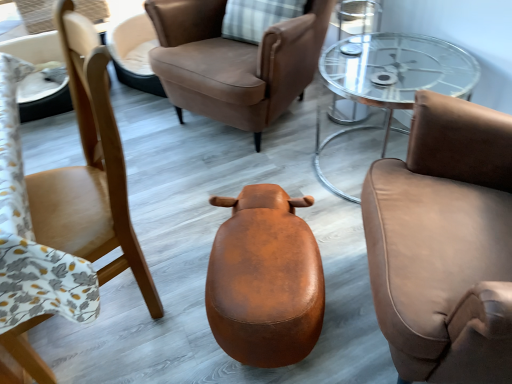
Question: Is brown leather chair at right, which is the 1th chair from right to left, at the right side of brown leather stool at center?

Choices:
 (A) yes
 (B) no

Answer: (A)

Question: From a real-world perspective, is brown leather chair at right, which is the 1th chair from right to left, positioned under brown leather stool at center based on gravity?

Choices:
 (A) yes
 (B) no

Answer: (B)

Question: Considering the relative sizes of brown leather chair at right, the third chair when ordered from left to right, and brown leather stool at center in the image provided, is brown leather chair at right, the third chair when ordered from left to right, wider than brown leather stool at center?

Choices:
 (A) no
 (B) yes

Answer: (A)

Question: From the image's perspective, is brown leather chair at right, which is the 1th chair from right to left, under brown leather stool at center?

Choices:
 (A) yes
 (B) no

Answer: (B)

Question: Is brown leather chair at right, which is the 1th chair from right to left, with brown leather stool at center?

Choices:
 (A) no
 (B) yes

Answer: (A)

Question: Visually, is brown leather chair at right, the third chair when ordered from left to right, positioned to the left or to the right of brown leather chair at center, which is the 2th chair from right to left?

Choices:
 (A) right
 (B) left

Answer: (A)

Question: From the image's perspective, is brown leather chair at right, the third chair when ordered from left to right, positioned above or below brown leather chair at center, which is the 2th chair from right to left?

Choices:
 (A) below
 (B) above

Answer: (A)

Question: Does point (400, 279) appear closer or farther from the camera than point (179, 100)?

Choices:
 (A) farther
 (B) closer

Answer: (B)

Question: Considering the positions of brown leather chair at right, which is the 1th chair from right to left, and brown leather chair at center, which is the 2th chair from right to left, in the image, is brown leather chair at right, which is the 1th chair from right to left, wider or thinner than brown leather chair at center, which is the 2th chair from right to left,?

Choices:
 (A) thin
 (B) wide

Answer: (A)

Question: Looking at their shapes, would you say clear glass coffee table at center is wider or thinner than brown leather stool at center?

Choices:
 (A) wide
 (B) thin

Answer: (B)

Question: Is point (410, 84) closer or farther from the camera than point (252, 200)?

Choices:
 (A) closer
 (B) farther

Answer: (B)

Question: Is clear glass coffee table at center in front of or behind brown leather stool at center in the image?

Choices:
 (A) behind
 (B) front

Answer: (A)

Question: Would you say clear glass coffee table at center is inside or outside brown leather stool at center?

Choices:
 (A) outside
 (B) inside

Answer: (A)

Question: Relative to brown leather chair at right, the third chair when ordered from left to right, is brown leather stool at center in front or behind?

Choices:
 (A) front
 (B) behind

Answer: (B)

Question: Is point (256, 319) closer or farther from the camera than point (506, 372)?

Choices:
 (A) farther
 (B) closer

Answer: (A)